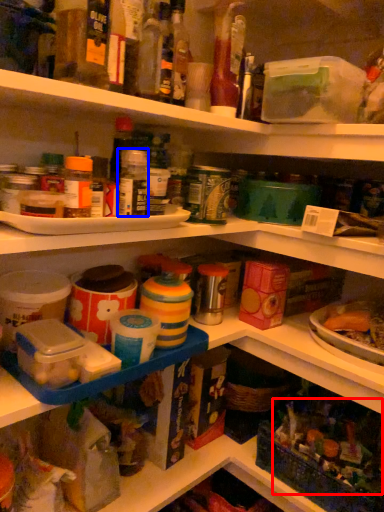
Question: Which of the following is the farthest to the observer, food (highlighted by a red box) or bottle (highlighted by a blue box)?

Choices:
 (A) food
 (B) bottle

Answer: (A)